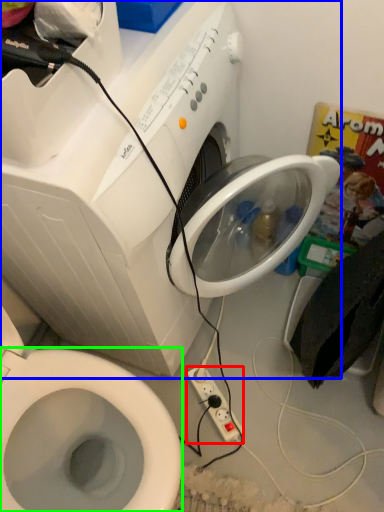
Question: Which is farther away from power plugs and sockets (highlighted by a red box)? washing machine (highlighted by a blue box) or bidet (highlighted by a green box)?

Choices:
 (A) washing machine
 (B) bidet

Answer: (A)